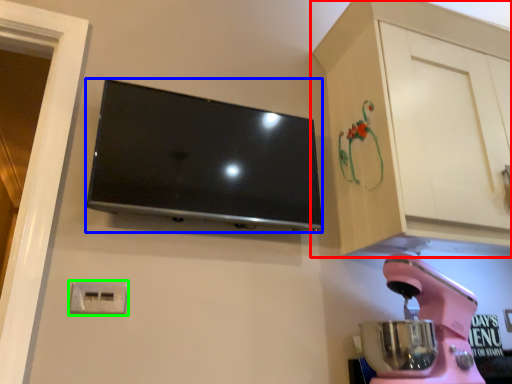
Question: Considering the real-world distances, which object is farthest from cabinetry (highlighted by a red box)? television (highlighted by a blue box) or electric outlet (highlighted by a green box)?

Choices:
 (A) television
 (B) electric outlet

Answer: (B)